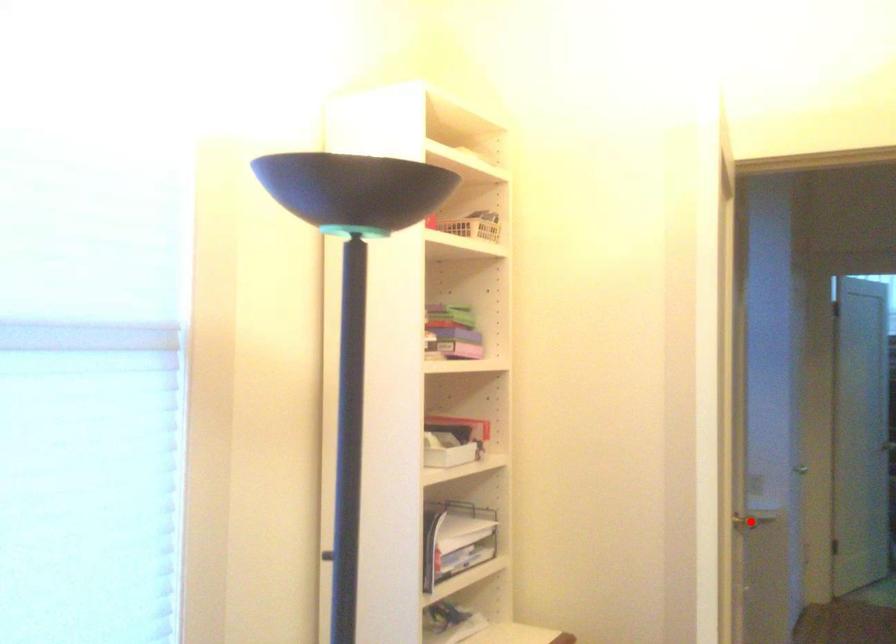
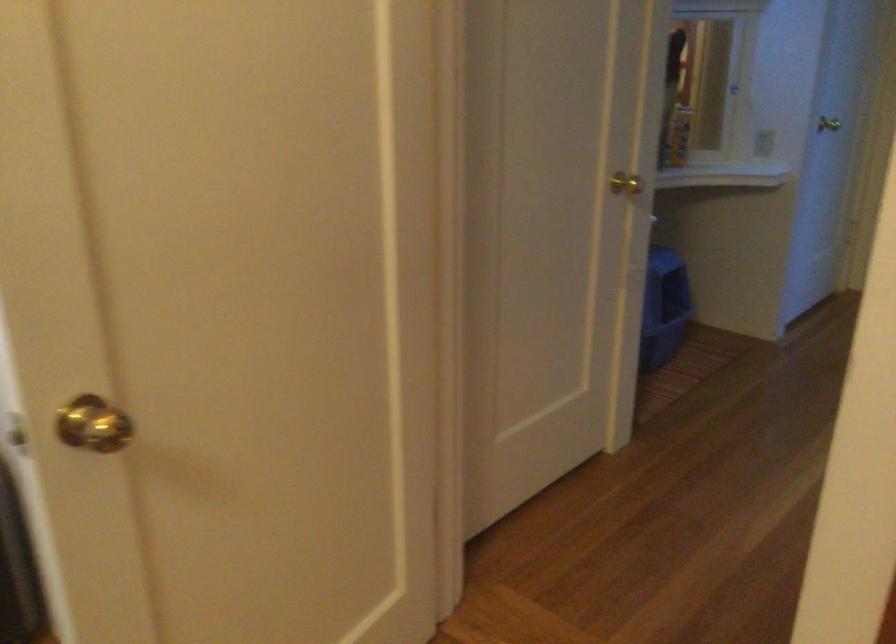
The point at the highlighted location is marked in the first image. Where is the corresponding point in the second image?

(625, 184)